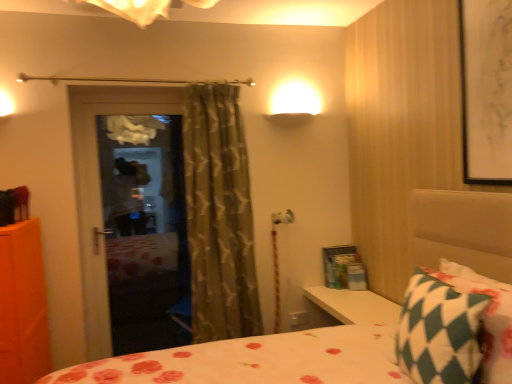
Locate an element on the screen. white paper at upper right is located at coordinates (486, 90).

You are a GUI agent. You are given a task and a screenshot of the screen. Output one action in this format:
    pyautogui.click(x=<x>, y=<y>)
    Task: Click on the green checkered pillow at lower right
    
    Given the screenshot: What is the action you would take?
    pyautogui.click(x=439, y=331)

Can you confirm if green checkered pillow at lower right is smaller than green textured curtain at center?

Indeed, green checkered pillow at lower right has a smaller size compared to green textured curtain at center.

Is the depth of green checkered pillow at lower right less than that of green textured curtain at center?

Yes, green checkered pillow at lower right is in front of green textured curtain at center.

Considering the points (252, 253) and (428, 370), which point is in front, point (252, 253) or point (428, 370)?

The point (428, 370) is closer.

Who is smaller, green textured curtain at center or green checkered pillow at lower right?

green checkered pillow at lower right is smaller.

Can you confirm if green textured curtain at center is wider than green checkered pillow at lower right?

Yes, green textured curtain at center is wider than green checkered pillow at lower right.

The image size is (512, 384). What are the coordinates of `curtain above the green checkered pillow at lower right (from the image's perspective)` in the screenshot? It's located at (x=219, y=215).

Is green checkered pillow at lower right situated inside white paper at upper right or outside?

The correct answer is: outside.

Is green checkered pillow at lower right at the left side of white paper at upper right?

Yes, green checkered pillow at lower right is to the left of white paper at upper right.

How different are the orientations of green checkered pillow at lower right and white paper at upper right in degrees?

There is a 0.858-degree angle between the facing directions of green checkered pillow at lower right and white paper at upper right.

Can you confirm if green textured curtain at center is wider than white paper at upper right?

Correct, the width of green textured curtain at center exceeds that of white paper at upper right.

In the image, there is a white paper at upper right. Where is `curtain below it (from a real-world perspective)`? Image resolution: width=512 pixels, height=384 pixels. curtain below it (from a real-world perspective) is located at coordinates (219, 215).

Is green textured curtain at center bigger than white paper at upper right?

Correct, green textured curtain at center is larger in size than white paper at upper right.

From the image's perspective, is green textured curtain at center located above white paper at upper right?

No, from the image's perspective, green textured curtain at center is not over white paper at upper right.

Considering the relative sizes of white paper at upper right and green checkered pillow at lower right in the image provided, is white paper at upper right bigger than green checkered pillow at lower right?

No.

From the picture: Is white paper at upper right next to green checkered pillow at lower right and touching it?

No, white paper at upper right is not next to green checkered pillow at lower right.

From a real-world perspective, is white paper at upper right above or below green checkered pillow at lower right?

white paper at upper right is above green checkered pillow at lower right.

Is white paper at upper right to the left of green textured curtain at center from the viewer's perspective?

No, white paper at upper right is not to the left of green textured curtain at center.

Is white paper at upper right oriented towards green textured curtain at center?

No, white paper at upper right is not turned towards green textured curtain at center.

From the image's perspective, between white paper at upper right and green textured curtain at center, who is located below?

green textured curtain at center.

Is green textured curtain at center a part of white paper at upper right?

Actually, green textured curtain at center is outside white paper at upper right.

Where is `curtain above the green checkered pillow at lower right (from the image's perspective)`? Image resolution: width=512 pixels, height=384 pixels. curtain above the green checkered pillow at lower right (from the image's perspective) is located at coordinates (219, 215).

Find the location of a particular element. The width and height of the screenshot is (512, 384). pillow beneath the green textured curtain at center (from a real-world perspective) is located at coordinates (439, 331).

From the image, which object appears to be nearer to green textured curtain at center, white paper at upper right or green checkered pillow at lower right?

Among the two, green checkered pillow at lower right is located nearer to green textured curtain at center.

When comparing their distances from green textured curtain at center, does green checkered pillow at lower right or white paper at upper right seem closer?

Among the two, green checkered pillow at lower right is located nearer to green textured curtain at center.

Based on their spatial positions, is green textured curtain at center or white paper at upper right further from green checkered pillow at lower right?

Among the two, green textured curtain at center is located further to green checkered pillow at lower right.

Estimate the real-world distances between objects in this image. Which object is further from green checkered pillow at lower right, white paper at upper right or green textured curtain at center?

green textured curtain at center lies further to green checkered pillow at lower right than the other object.

Looking at this image, estimate the real-world distances between objects in this image. Which object is closer to white paper at upper right, green textured curtain at center or green checkered pillow at lower right?

green checkered pillow at lower right is positioned closer to the anchor white paper at upper right.

Based on their spatial positions, is green checkered pillow at lower right or green textured curtain at center further from white paper at upper right?

green textured curtain at center.

You are a GUI agent. You are given a task and a screenshot of the screen. Output one action in this format:
    pyautogui.click(x=<x>, y=<y>)
    Task: Click on the pillow between green textured curtain at center and white paper at upper right
    The width and height of the screenshot is (512, 384).
    Given the screenshot: What is the action you would take?
    pyautogui.click(x=439, y=331)